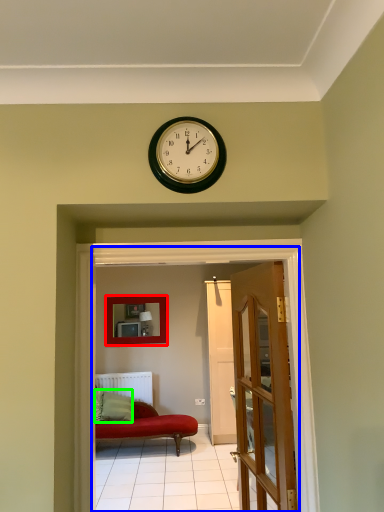
Question: Based on their relative distances, which object is farther from picture frame (highlighted by a red box)? Choose from corridor (highlighted by a blue box) and pillow (highlighted by a green box).

Choices:
 (A) corridor
 (B) pillow

Answer: (A)